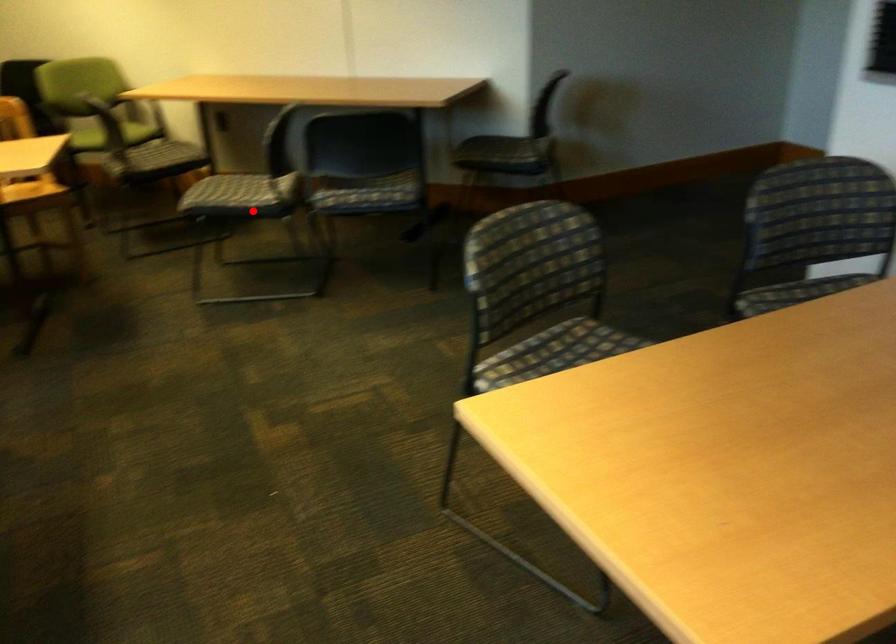
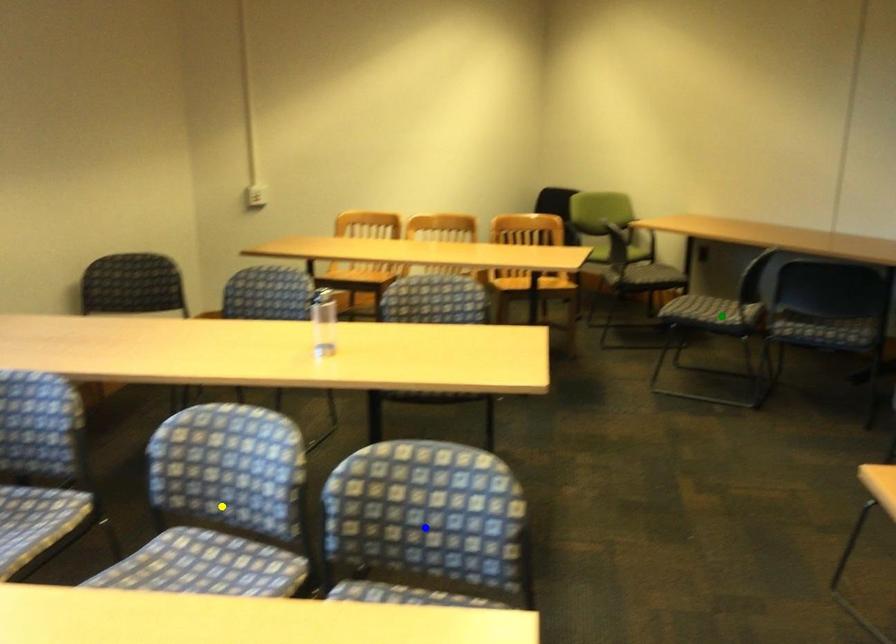
Question: I am providing you with two images of the same scene from different viewpoints. A red point is marked on the first image. You are given multiple points on the second image. Which point in image 2 is actually the same real-world point as the red point in image 1?

Choices:
 (A) green point
 (B) blue point
 (C) yellow point

Answer: (A)